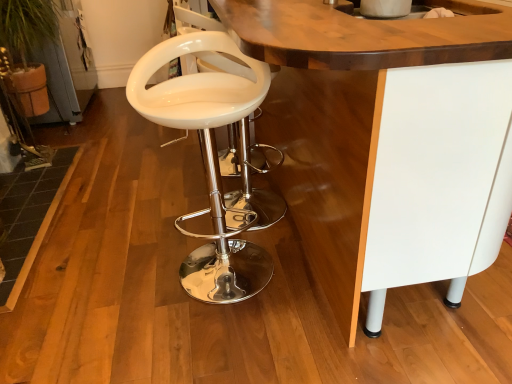
What are the coordinates of `vacant location below white glossy bar stool at center (from a real-world perspective)` in the screenshot? It's located at (205, 266).